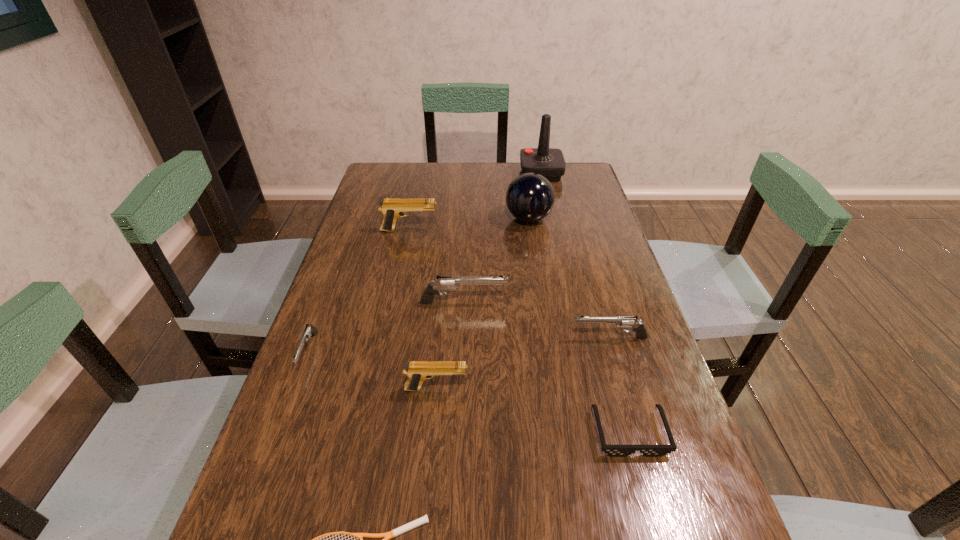
The image size is (960, 540). I want to click on pistol that is at the right edge, so click(x=623, y=322).

Where is `sunglasses at the right edge`? The height and width of the screenshot is (540, 960). sunglasses at the right edge is located at coordinates [613, 450].

Image resolution: width=960 pixels, height=540 pixels. Find the location of `object that is at the far right corner`. object that is at the far right corner is located at coordinates (549, 162).

I want to click on vacant space at the far edge of the desktop, so click(491, 166).

The height and width of the screenshot is (540, 960). I want to click on free space at the left edge, so click(x=364, y=271).

This screenshot has height=540, width=960. In the image, there is a desktop. Identify the location of free space at the right edge. (576, 230).

Locate an element on the screen. This screenshot has height=540, width=960. vacant space in between the second shortest pistol and the smaller tan pistol is located at coordinates (523, 363).

I want to click on vacant space that is in between the farthest object and the bigger tan pistol, so click(x=475, y=202).

Find the location of a particular element. The height and width of the screenshot is (540, 960). empty location between the nearer tan pistol and the second tallest object is located at coordinates (483, 303).

What are the coordinates of `free space between the eighth shortest object and the second nearest object` in the screenshot? It's located at (579, 326).